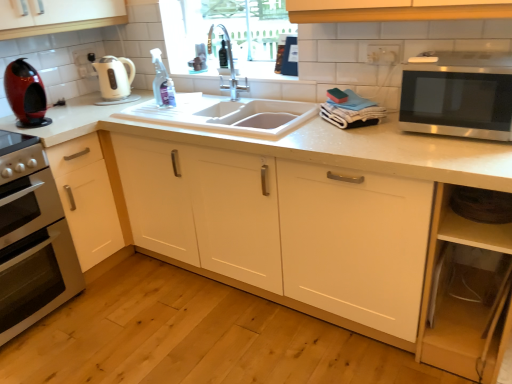
This screenshot has width=512, height=384. Find the location of `silver metallic faucet at center`. silver metallic faucet at center is located at coordinates (227, 63).

You are a GUI agent. You are given a task and a screenshot of the screen. Output one action in this format:
    pyautogui.click(x=<x>, y=<y>)
    Task: Click on the silver metallic faucet at center
    The image size is (512, 384).
    Given the screenshot: What is the action you would take?
    pyautogui.click(x=227, y=63)

Can you confirm if white matte cabinet at center, marked as the 1th cabinetry in a right-to-left arrangement, is bigger than white matte cabinet at lower left, positioned as the second cabinetry in right-to-left order?

Yes, white matte cabinet at center, marked as the 1th cabinetry in a right-to-left arrangement, is bigger than white matte cabinet at lower left, positioned as the second cabinetry in right-to-left order.

Could you tell me if white matte cabinet at center, positioned as the second cabinetry in left-to-right order, is facing white matte cabinet at lower left, which ranks as the first cabinetry in left-to-right order?

Yes, white matte cabinet at center, positioned as the second cabinetry in left-to-right order, faces towards white matte cabinet at lower left, which ranks as the first cabinetry in left-to-right order.

Is white matte cabinet at center, marked as the 1th cabinetry in a right-to-left arrangement, wider than white matte cabinet at lower left, positioned as the second cabinetry in right-to-left order?

Yes, white matte cabinet at center, marked as the 1th cabinetry in a right-to-left arrangement, is wider than white matte cabinet at lower left, positioned as the second cabinetry in right-to-left order.

Considering the relative sizes of white matte cabinet at center, positioned as the second cabinetry in left-to-right order, and white matte cabinet at lower left, positioned as the second cabinetry in right-to-left order, in the image provided, is white matte cabinet at center, positioned as the second cabinetry in left-to-right order, shorter than white matte cabinet at lower left, positioned as the second cabinetry in right-to-left order,?

No, white matte cabinet at center, positioned as the second cabinetry in left-to-right order, is not shorter than white matte cabinet at lower left, positioned as the second cabinetry in right-to-left order.

Looking at the image, does shiny red coffee machine at left seem bigger or smaller compared to white matte cabinet at lower left, which ranks as the first cabinetry in left-to-right order?

In the image, shiny red coffee machine at left appears to be smaller than white matte cabinet at lower left, which ranks as the first cabinetry in left-to-right order.

Based on the photo, which of these two, shiny red coffee machine at left or white matte cabinet at lower left, which ranks as the first cabinetry in left-to-right order, is wider?

white matte cabinet at lower left, which ranks as the first cabinetry in left-to-right order.

Which is more to the left, shiny red coffee machine at left or white matte cabinet at lower left, positioned as the second cabinetry in right-to-left order?

shiny red coffee machine at left.

Does point (25, 63) appear closer or farther from the camera than point (98, 259)?

Point (25, 63).

Is white matte cabinet at lower left, positioned as the second cabinetry in right-to-left order, wider than white glossy electric kettle at upper left?

Correct, the width of white matte cabinet at lower left, positioned as the second cabinetry in right-to-left order, exceeds that of white glossy electric kettle at upper left.

Can you confirm if white matte cabinet at lower left, positioned as the second cabinetry in right-to-left order, is shorter than white glossy electric kettle at upper left?

Incorrect, the height of white matte cabinet at lower left, positioned as the second cabinetry in right-to-left order, does not fall short of that of white glossy electric kettle at upper left.

Is the surface of white matte cabinet at lower left, positioned as the second cabinetry in right-to-left order, in direct contact with white glossy electric kettle at upper left?

No, white matte cabinet at lower left, positioned as the second cabinetry in right-to-left order, is not next to white glossy electric kettle at upper left.

Is white matte cabinet at lower left, which ranks as the first cabinetry in left-to-right order, not within white glossy electric kettle at upper left?

Yes, white matte cabinet at lower left, which ranks as the first cabinetry in left-to-right order, is located beyond the bounds of white glossy electric kettle at upper left.

From a real-world perspective, is stainless steel microwave at right above or below white matte cabinet at center, positioned as the second cabinetry in left-to-right order?

Clearly, from a real-world perspective, stainless steel microwave at right is above white matte cabinet at center, positioned as the second cabinetry in left-to-right order.

Which object is further away from the camera taking this photo, stainless steel microwave at right or white matte cabinet at center, marked as the 1th cabinetry in a right-to-left arrangement?

stainless steel microwave at right is more distant.

Does stainless steel microwave at right have a greater height compared to white matte cabinet at center, positioned as the second cabinetry in left-to-right order?

In fact, stainless steel microwave at right may be shorter than white matte cabinet at center, positioned as the second cabinetry in left-to-right order.

Is white glossy oven at left next to shiny red coffee machine at left?

No, white glossy oven at left is not touching shiny red coffee machine at left.

Does white glossy oven at left contain shiny red coffee machine at left?

No, shiny red coffee machine at left is not inside white glossy oven at left.

Is point (11, 197) farther from viewer compared to point (41, 101)?

No, it is not.

From the image's perspective, is white glossy oven at left located beneath shiny red coffee machine at left?

Yes, from the image's perspective, white glossy oven at left is beneath shiny red coffee machine at left.

Is point (467, 52) closer to viewer compared to point (102, 69)?

Yes.

Considering the sizes of stainless steel microwave at right and white glossy electric kettle at upper left in the image, is stainless steel microwave at right taller or shorter than white glossy electric kettle at upper left?

Considering their sizes, stainless steel microwave at right has more height than white glossy electric kettle at upper left.

How many degrees apart are the facing directions of stainless steel microwave at right and white glossy electric kettle at upper left?

There is a 90-degree angle between the facing directions of stainless steel microwave at right and white glossy electric kettle at upper left.

Can we say white glossy electric kettle at upper left lies outside white glossy oven at left?

That's correct, white glossy electric kettle at upper left is outside of white glossy oven at left.

From the image's perspective, which one is positioned lower, white glossy electric kettle at upper left or white glossy oven at left?

white glossy oven at left appears lower in the image.

In the scene shown: Considering the relative sizes of white glossy electric kettle at upper left and white glossy oven at left in the image provided, is white glossy electric kettle at upper left taller than white glossy oven at left?

No.

Is white glossy electric kettle at upper left to the right of white glossy oven at left from the viewer's perspective?

Correct, you'll find white glossy electric kettle at upper left to the right of white glossy oven at left.

Where is `cabinetry located on the right of white matte cabinet at lower left, positioned as the second cabinetry in right-to-left order`? cabinetry located on the right of white matte cabinet at lower left, positioned as the second cabinetry in right-to-left order is located at coordinates (285, 228).

In the image, there is a white matte cabinet at lower left, which ranks as the first cabinetry in left-to-right order. Where is `coffee machine above it (from the image's perspective)`? coffee machine above it (from the image's perspective) is located at coordinates (26, 94).

Estimate the real-world distances between objects in this image. Which object is further from white glossy electric kettle at upper left, white matte cabinet at center, marked as the 1th cabinetry in a right-to-left arrangement, or shiny red coffee machine at left?

white matte cabinet at center, marked as the 1th cabinetry in a right-to-left arrangement, lies further to white glossy electric kettle at upper left than the other object.

Looking at the image, which one is located further to white glossy oven at left, white glossy electric kettle at upper left or silver metallic faucet at center?

silver metallic faucet at center is further to white glossy oven at left.

Considering their positions, is white glossy electric kettle at upper left positioned closer to silver metallic faucet at center than white matte cabinet at center, positioned as the second cabinetry in left-to-right order?

The object closer to silver metallic faucet at center is white glossy electric kettle at upper left.

In the scene shown: When comparing their distances from stainless steel microwave at right, does white glossy electric kettle at upper left or silver metallic faucet at center seem closer?

Among the two, silver metallic faucet at center is located nearer to stainless steel microwave at right.

Estimate the real-world distances between objects in this image. Which object is further from white matte cabinet at lower left, positioned as the second cabinetry in right-to-left order, white matte cabinet at center, marked as the 1th cabinetry in a right-to-left arrangement, or shiny red coffee machine at left?

Among the two, white matte cabinet at center, marked as the 1th cabinetry in a right-to-left arrangement, is located further to white matte cabinet at lower left, positioned as the second cabinetry in right-to-left order.

Which object lies further to the anchor point white matte cabinet at lower left, positioned as the second cabinetry in right-to-left order, stainless steel microwave at right or silver metallic faucet at center?

Based on the image, stainless steel microwave at right appears to be further to white matte cabinet at lower left, positioned as the second cabinetry in right-to-left order.

From the image, which object appears to be farther from stainless steel microwave at right, white glossy oven at left or white matte cabinet at center, positioned as the second cabinetry in left-to-right order?

white glossy oven at left is further to stainless steel microwave at right.

From the image, which object appears to be farther from stainless steel microwave at right, white matte cabinet at center, marked as the 1th cabinetry in a right-to-left arrangement, or shiny red coffee machine at left?

shiny red coffee machine at left lies further to stainless steel microwave at right than the other object.

Where is `cabinetry situated between shiny red coffee machine at left and silver metallic faucet at center from left to right`? cabinetry situated between shiny red coffee machine at left and silver metallic faucet at center from left to right is located at coordinates (90, 198).

Locate an element on the screen. The image size is (512, 384). coffee machine between white glossy electric kettle at upper left and white glossy oven at left in the up-down direction is located at coordinates (26, 94).

You are a GUI agent. You are given a task and a screenshot of the screen. Output one action in this format:
    pyautogui.click(x=<x>, y=<y>)
    Task: Click on the faucet between shiny red coffee machine at left and stainless steel microwave at right in the horizontal direction
    This screenshot has height=384, width=512.
    Given the screenshot: What is the action you would take?
    pyautogui.click(x=227, y=63)

The height and width of the screenshot is (384, 512). Find the location of `coffee machine between white glossy oven at left and white matte cabinet at center, marked as the 1th cabinetry in a right-to-left arrangement, in the horizontal direction`. coffee machine between white glossy oven at left and white matte cabinet at center, marked as the 1th cabinetry in a right-to-left arrangement, in the horizontal direction is located at coordinates (26, 94).